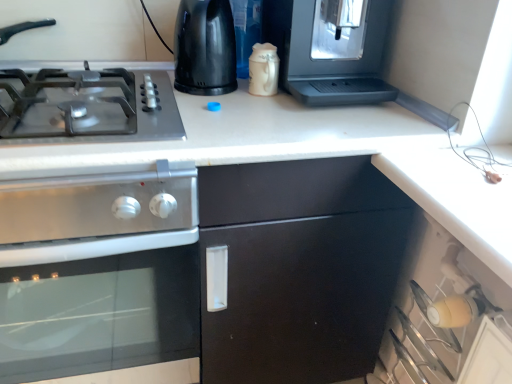
Question: Which direction should I rotate to look at black plastic kettle at upper center, the second appliance when ordered from right to left?

Choices:
 (A) left
 (B) right

Answer: (A)

Question: From a real-world perspective, is stainless steel oven at left on metallic gray gas stove at left?

Choices:
 (A) yes
 (B) no

Answer: (B)

Question: Is stainless steel oven at left far away from metallic gray gas stove at left?

Choices:
 (A) yes
 (B) no

Answer: (B)

Question: Does stainless steel oven at left lie behind metallic gray gas stove at left?

Choices:
 (A) no
 (B) yes

Answer: (A)

Question: Does stainless steel oven at left have a lesser width compared to metallic gray gas stove at left?

Choices:
 (A) yes
 (B) no

Answer: (B)

Question: Considering the relative positions of stainless steel oven at left and metallic gray gas stove at left in the image provided, is stainless steel oven at left in front of metallic gray gas stove at left?

Choices:
 (A) no
 (B) yes

Answer: (B)

Question: Can you confirm if stainless steel oven at left is positioned to the left of metallic gray gas stove at left?

Choices:
 (A) yes
 (B) no

Answer: (A)

Question: Considering the relative sizes of satin silver coffee machine at upper right, arranged as the first appliance when viewed from the right, and metallic gray gas stove at left in the image provided, is satin silver coffee machine at upper right, arranged as the first appliance when viewed from the right, shorter than metallic gray gas stove at left?

Choices:
 (A) yes
 (B) no

Answer: (B)

Question: Would you say satin silver coffee machine at upper right, arranged as the first appliance when viewed from the right, is outside metallic gray gas stove at left?

Choices:
 (A) no
 (B) yes

Answer: (B)

Question: From a real-world perspective, is satin silver coffee machine at upper right, which is counted as the 2th appliance, starting from the left, located beneath metallic gray gas stove at left?

Choices:
 (A) no
 (B) yes

Answer: (A)

Question: Is satin silver coffee machine at upper right, arranged as the first appliance when viewed from the right, wider than metallic gray gas stove at left?

Choices:
 (A) yes
 (B) no

Answer: (B)

Question: From the image's perspective, is satin silver coffee machine at upper right, which is counted as the 2th appliance, starting from the left, located beneath metallic gray gas stove at left?

Choices:
 (A) no
 (B) yes

Answer: (A)

Question: Could you tell me if satin silver coffee machine at upper right, which is counted as the 2th appliance, starting from the left, is turned towards metallic gray gas stove at left?

Choices:
 (A) no
 (B) yes

Answer: (A)

Question: Is metallic gray gas stove at left with satin silver coffee machine at upper right, which is counted as the 2th appliance, starting from the left?

Choices:
 (A) yes
 (B) no

Answer: (B)